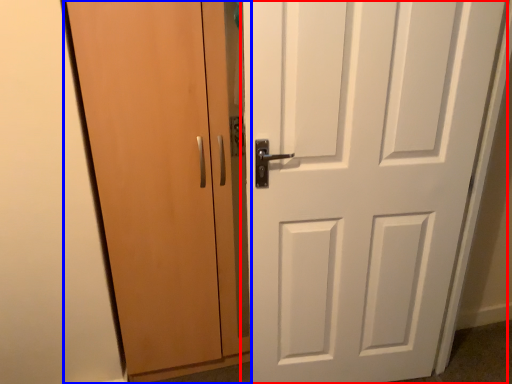
Question: Which object appears farthest to the camera in this image, door (highlighted by a red box) or door (highlighted by a blue box)?

Choices:
 (A) door
 (B) door

Answer: (B)